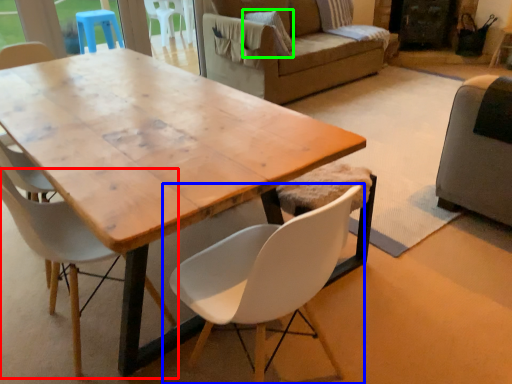
Question: Based on their relative distances, which object is farther from chair (highlighted by a red box)? Choose from chair (highlighted by a blue box) and pillow (highlighted by a green box).

Choices:
 (A) chair
 (B) pillow

Answer: (B)